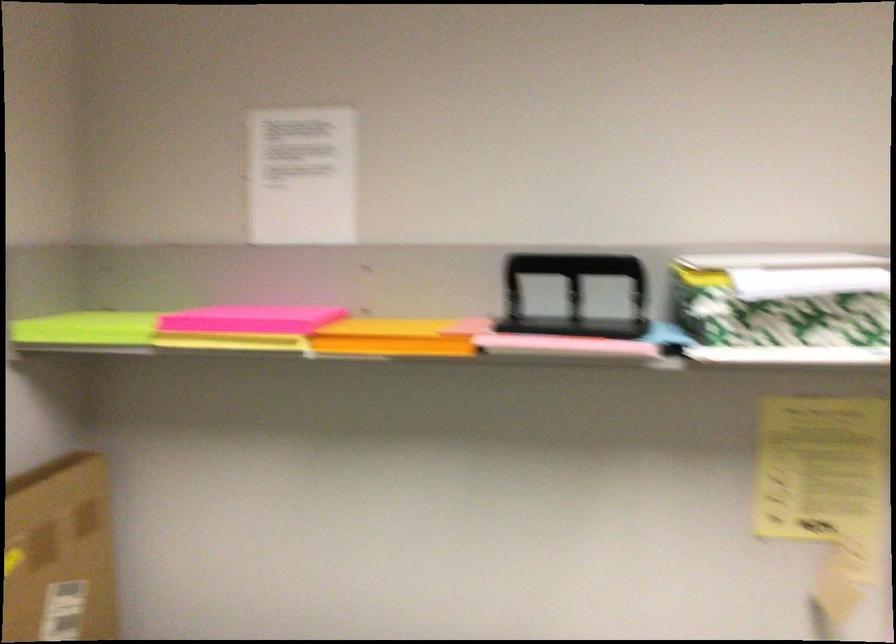
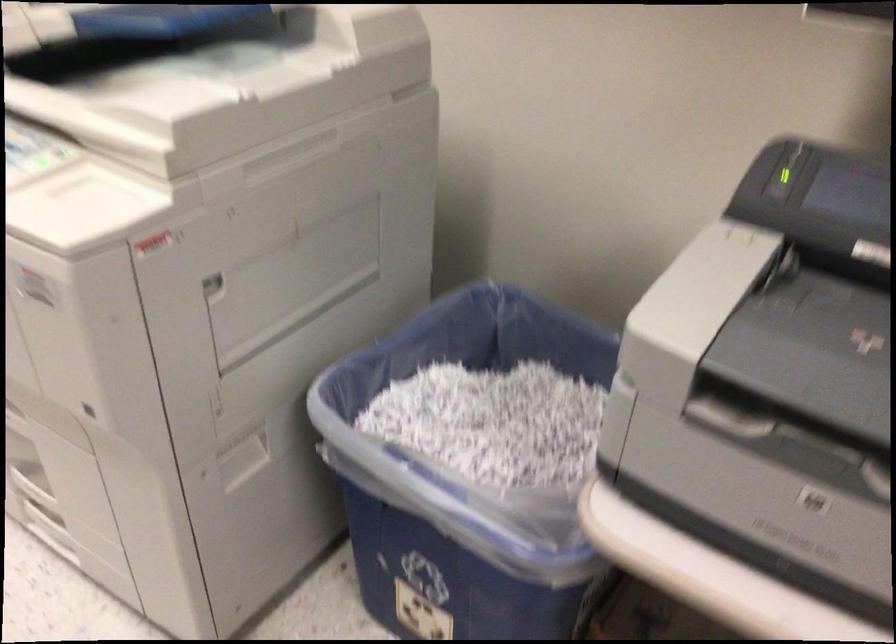
Question: In a continuous first-person perspective shot, in which direction is the camera moving?

Choices:
 (A) Left
 (B) Right
 (C) Forward
 (D) Backward

Answer: (D)